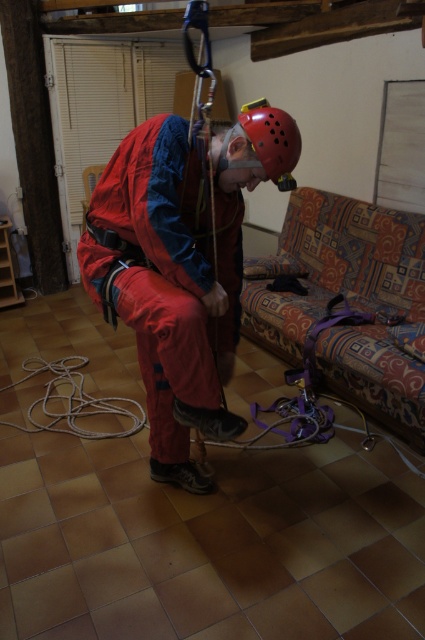
You are an interior designer assessing the space for furniture placement. Given the presence of the patterned fabric couch at lower right and the red matte helmet at center, which object would you consider for potential repositioning to optimize space, and why?

The patterned fabric couch at lower right should be considered for repositioning because it is larger than the red matte helmet at center, making it more impactful on spatial optimization.

You are a delivery robot with a package that is 1.5 meters wide. You need to move from the entrance to the patterned fabric couch at lower right. Is there enough space between the red matte helmet at center and the couch to pass through?

The distance between the patterned fabric couch at lower right and the red matte helmet at center is 1.39 meters. Since the package is 1.5 meters wide, it is wider than the available space. Therefore, the delivery robot cannot pass through the space between them.